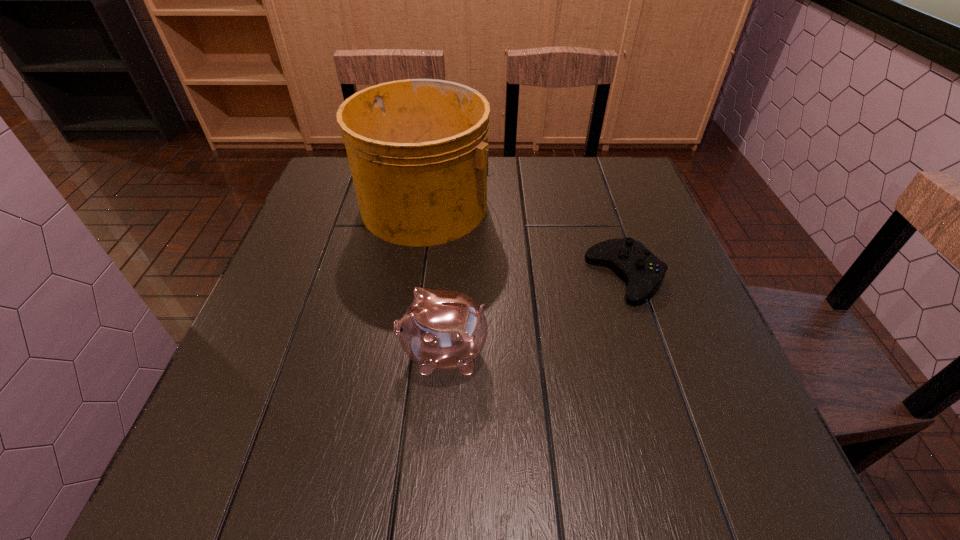
Identify which object is located as the second nearest to the bucket. Please provide its 2D coordinates. Your answer should be formatted as a tuple, i.e. [(x, y)], where the tuple contains the x and y coordinates of a point satisfying the conditions above.

[(439, 330)]

Choose which object is the nearest neighbor to the nearest object. Please provide its 2D coordinates. Your answer should be formatted as a tuple, i.e. [(x, y)], where the tuple contains the x and y coordinates of a point satisfying the conditions above.

[(418, 149)]

Locate an element on the screen. This screenshot has height=540, width=960. free space that satisfies the following two spatial constraints: 1. on the front side of the rightmost object; 2. on the front facing side of the second tallest object is located at coordinates (651, 353).

Where is `free spot that satisfies the following two spatial constraints: 1. on the front side of the rightmost object; 2. on the front facing side of the nearest object`? The width and height of the screenshot is (960, 540). free spot that satisfies the following two spatial constraints: 1. on the front side of the rightmost object; 2. on the front facing side of the nearest object is located at coordinates (651, 353).